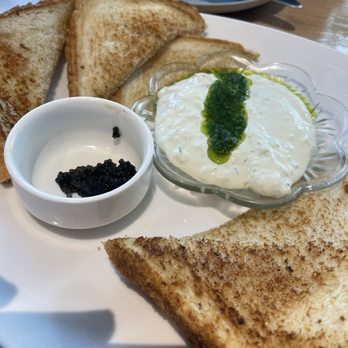
I want to click on three slices of toast on upper right corner of plate, so click(39, 51), click(121, 26), click(170, 60).